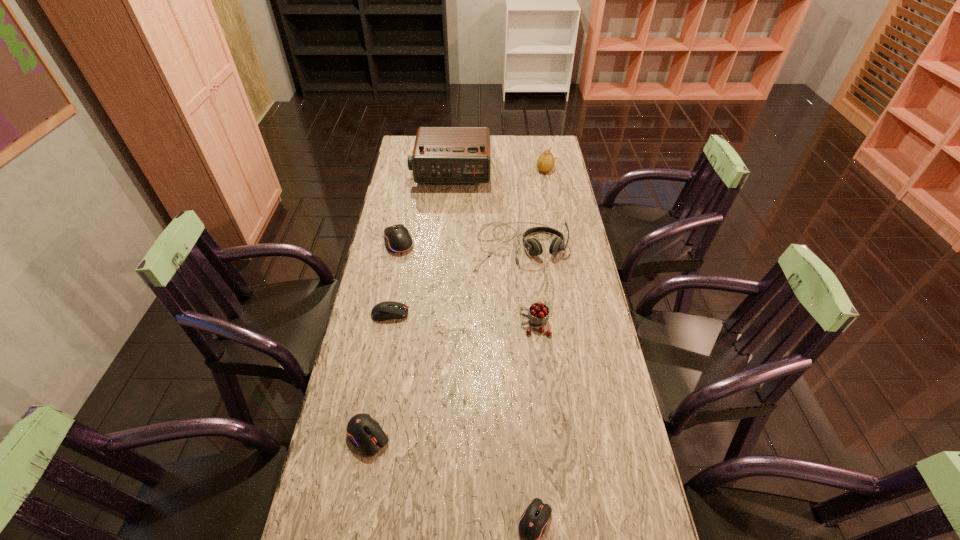
Where is `radio receiver at the left edge`? The width and height of the screenshot is (960, 540). radio receiver at the left edge is located at coordinates (441, 154).

This screenshot has height=540, width=960. I want to click on pear that is at the right edge, so click(545, 163).

You are a GUI agent. You are given a task and a screenshot of the screen. Output one action in this format:
    pyautogui.click(x=<x>, y=<y>)
    Task: Click on the cherry that is at the right edge
    
    Given the screenshot: What is the action you would take?
    pyautogui.click(x=538, y=315)

In order to click on headset that is at the right edge in this screenshot , I will do `click(532, 245)`.

Where is `object that is at the far left corner`? The height and width of the screenshot is (540, 960). object that is at the far left corner is located at coordinates (441, 154).

Locate an element on the screen. Image resolution: width=960 pixels, height=540 pixels. blank space at the left edge is located at coordinates (412, 282).

Where is `free space at the right edge of the desktop`? free space at the right edge of the desktop is located at coordinates (638, 470).

Locate an element on the screen. This screenshot has height=540, width=960. empty space that is in between the dark computer equipment and the biggest black computer mouse is located at coordinates (395, 278).

Image resolution: width=960 pixels, height=540 pixels. Identify the location of empty location between the biggest black computer mouse and the sixth tallest object. (384, 339).

The width and height of the screenshot is (960, 540). Identify the location of free space between the seventh farthest object and the second farthest computer mouse. (379, 375).